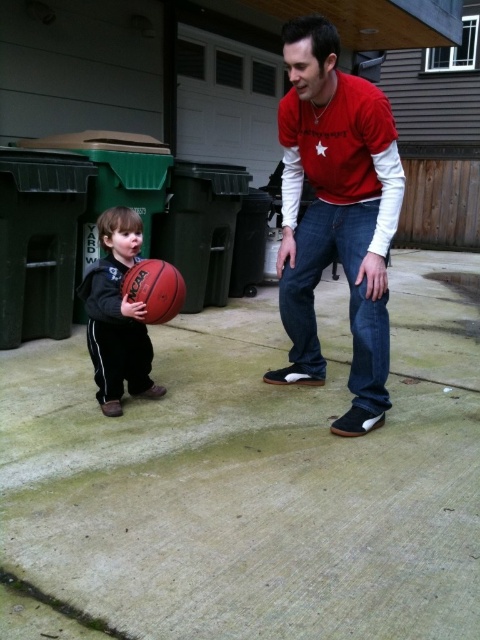
Which is more to the left, rubber basketball at left or rubber basketball at center?

rubber basketball at left

In the scene shown: Does rubber basketball at left have a larger size compared to rubber basketball at center?

Correct, rubber basketball at left is larger in size than rubber basketball at center.

Measure the distance between point (118, 410) and camera.

8.37 feet

You are a GUI agent. You are given a task and a screenshot of the screen. Output one action in this format:
    pyautogui.click(x=<x>, y=<y>)
    Task: Click on the rubber basketball at left
    
    Given the screenshot: What is the action you would take?
    pyautogui.click(x=117, y=316)

Looking at this image, can you confirm if red cotton shirt at center is shorter than rubber basketball at center?

Incorrect, red cotton shirt at center's height does not fall short of rubber basketball at center's.

Between red cotton shirt at center and rubber basketball at center, which one appears on the right side from the viewer's perspective?

red cotton shirt at center

Is point (330, 144) closer to camera compared to point (155, 296)?

No, (330, 144) is behind (155, 296).

At what (x,y) coordinates should I click in order to perform the action: click on red cotton shirt at center. Please return your answer as a coordinate pair (x, y). Looking at the image, I should click on (336, 214).

Is red cotton shirt at center smaller than rubber basketball at left?

No.

At what (x,y) coordinates should I click in order to perform the action: click on red cotton shirt at center. Please return your answer as a coordinate pair (x, y). Image resolution: width=480 pixels, height=640 pixels. Looking at the image, I should click on (336, 214).

Locate an element on the screen. This screenshot has height=640, width=480. red cotton shirt at center is located at coordinates (336, 214).